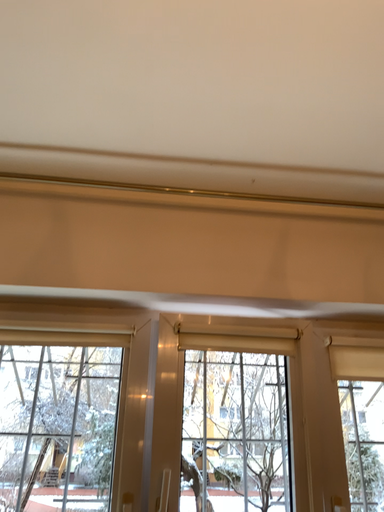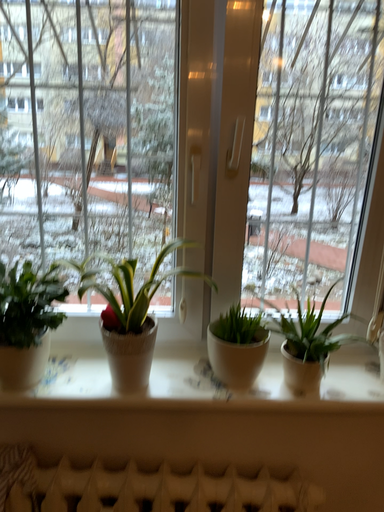
Question: How did the camera likely rotate when shooting the video?

Choices:
 (A) rotated upward
 (B) rotated downward

Answer: (B)